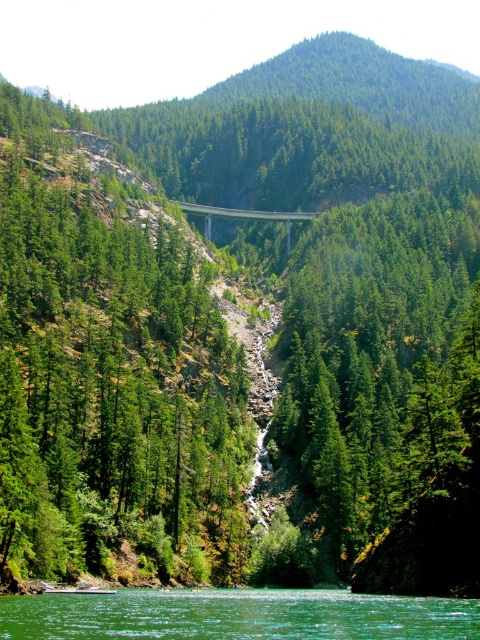
Can you confirm if green smooth water at lower center is taller than concrete bridge at center?

No, green smooth water at lower center is not taller than concrete bridge at center.

Image resolution: width=480 pixels, height=640 pixels. Find the location of `green smooth water at lower center`. green smooth water at lower center is located at coordinates (237, 616).

Between point (237, 628) and point (282, 220), which one is positioned in front?

Point (237, 628)

Locate an element on the screen. The height and width of the screenshot is (640, 480). green smooth water at lower center is located at coordinates (237, 616).